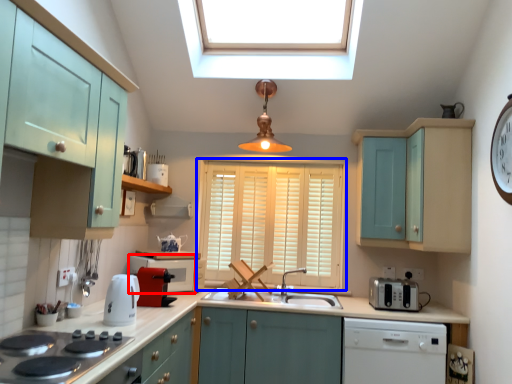
Question: Which object appears farthest to the camera in this image, appliance (highlighted by a red box) or window (highlighted by a blue box)?

Choices:
 (A) appliance
 (B) window

Answer: (B)